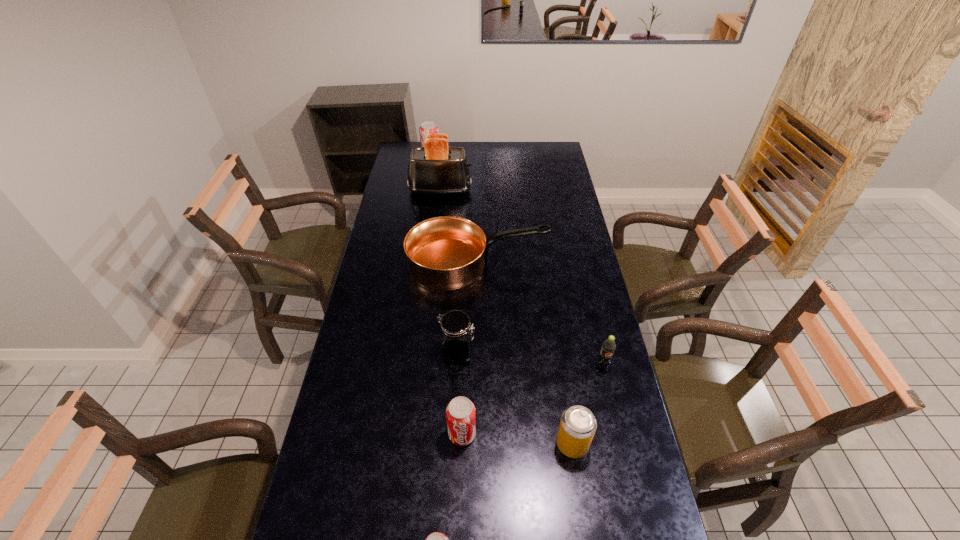
Locate an element on the screen. The width and height of the screenshot is (960, 540). frying pan at the left edge is located at coordinates (444, 253).

I want to click on object situated at the far left corner, so pyautogui.click(x=426, y=127).

In order to click on free space at the left edge in this screenshot , I will do `click(365, 516)`.

This screenshot has width=960, height=540. I want to click on free location at the right edge, so click(x=573, y=200).

Locate an element on the screen. The width and height of the screenshot is (960, 540). free space at the far right corner is located at coordinates (537, 151).

Find the location of `free point between the tallest object and the green soda`. free point between the tallest object and the green soda is located at coordinates (521, 278).

I want to click on free space between the rightmost soda can and the farthest red soda can, so click(x=516, y=262).

Identify the location of free space between the rightmost object and the jar. The image size is (960, 540). (530, 360).

Find the location of a particular element. The image size is (960, 540). free point between the leftmost soda can and the rightmost soda can is located at coordinates (516, 262).

At what (x,y) coordinates should I click in order to perform the action: click on free space between the fourth soda can from left to right and the second nearest red soda can. Please return your answer as a coordinate pair (x, y). This screenshot has height=540, width=960. Looking at the image, I should click on (517, 439).